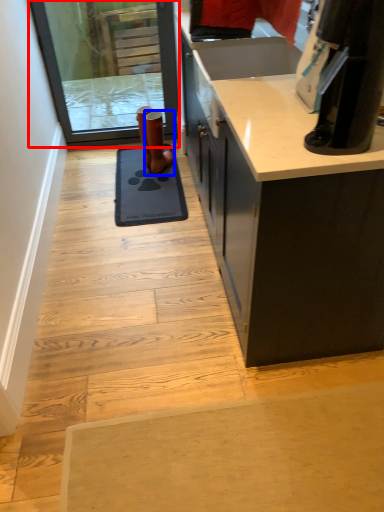
Question: Which object appears farthest to the camera in this image, screen door (highlighted by a red box) or footwear (highlighted by a blue box)?

Choices:
 (A) screen door
 (B) footwear

Answer: (B)